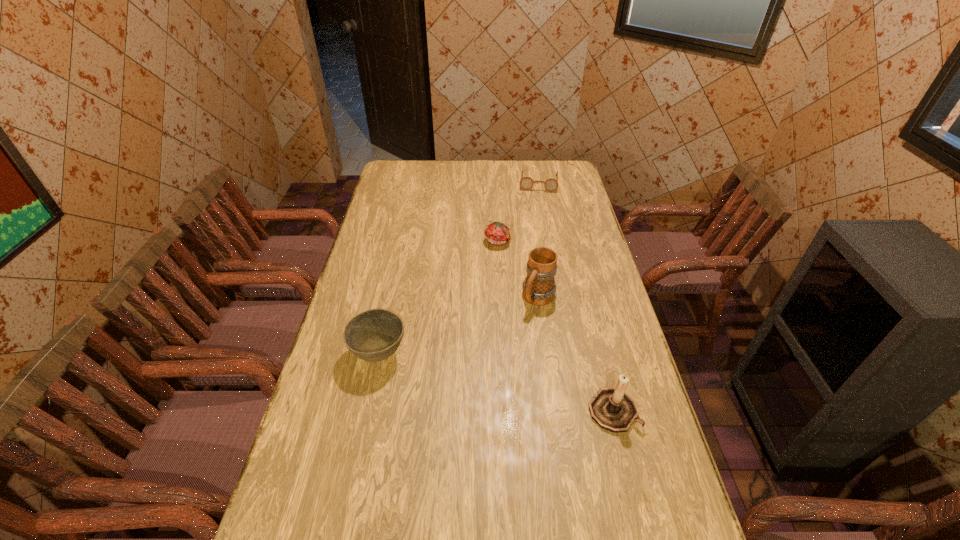
This screenshot has height=540, width=960. Identify the location of free space on the desktop that is between the bowl and the candle holder and is positioned on the front-facing side of the fourth tallest object. (515, 387).

Image resolution: width=960 pixels, height=540 pixels. What are the coordinates of `vacant space on the desktop that is between the third tallest object and the candle holder and is positioned on the side of the third farthest object with the handle` in the screenshot? It's located at (482, 379).

At what (x,y) coordinates should I click in order to perform the action: click on vacant space on the desktop that is between the fourth farthest object and the nearest object and is positioned on the front-facing side of the farthest object. Please return your answer as a coordinate pair (x, y). The width and height of the screenshot is (960, 540). Looking at the image, I should click on (524, 389).